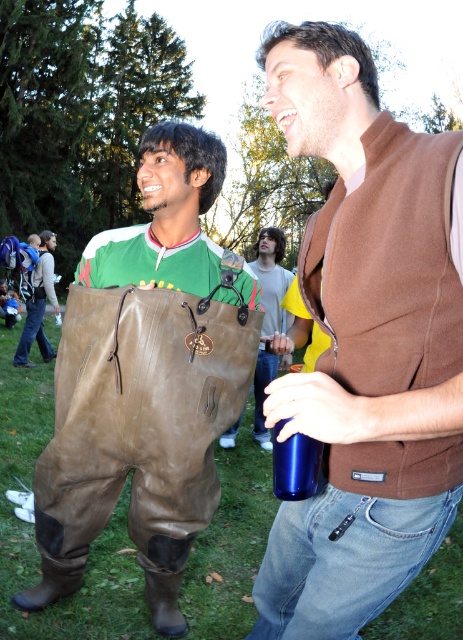
Consider the image. You are a photographer standing at the camera position. You want to take a photo of both point (342, 481) and point (231, 436) in the frame. Which point will appear larger in the photo?

Point (342, 481) is closer to the camera than point (231, 436), so it will appear larger in the photo.

You are an observer looking at the scene. You see the brown wool vest at upper right and the brown leather pants at lower left. Which of these two items is shorter in height?

The brown wool vest at upper right is shorter in height than the brown leather pants at lower left because it is not as tall as the brown leather pants at lower left.